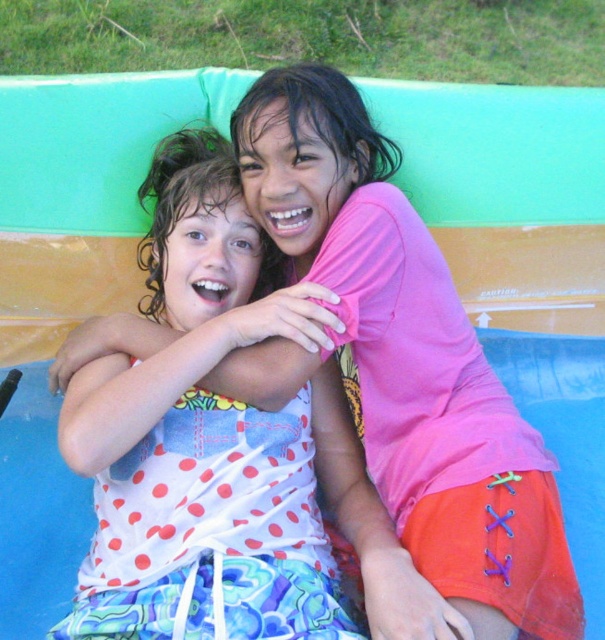
Between pink matte shirt at center and white polka dot fabric at center, which one is positioned higher?

pink matte shirt at center is higher up.

Between pink matte shirt at center and white polka dot fabric at center, which one has more height?

Standing taller between the two is pink matte shirt at center.

This screenshot has width=605, height=640. What do you see at coordinates (411, 358) in the screenshot?
I see `pink matte shirt at center` at bounding box center [411, 358].

I want to click on pink matte shirt at center, so click(411, 358).